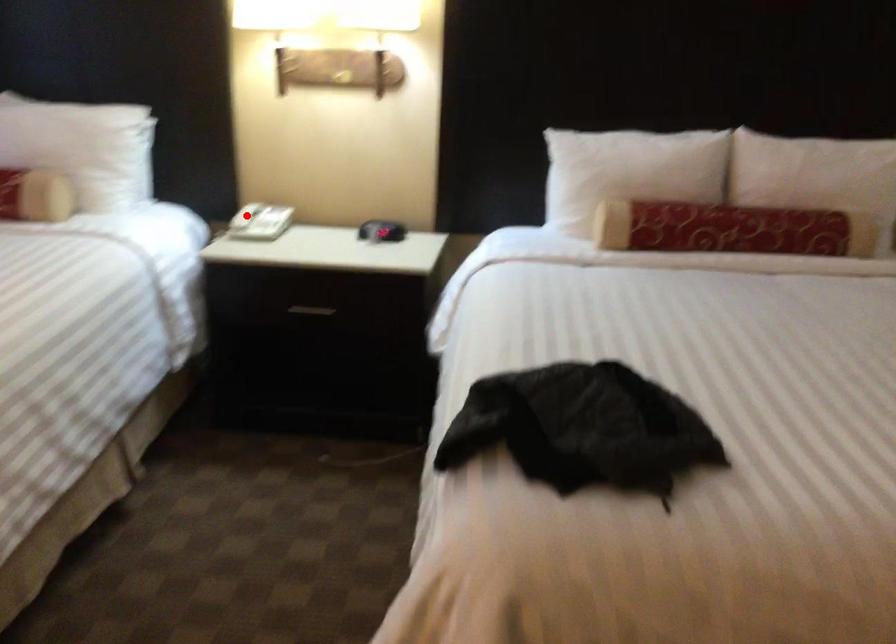
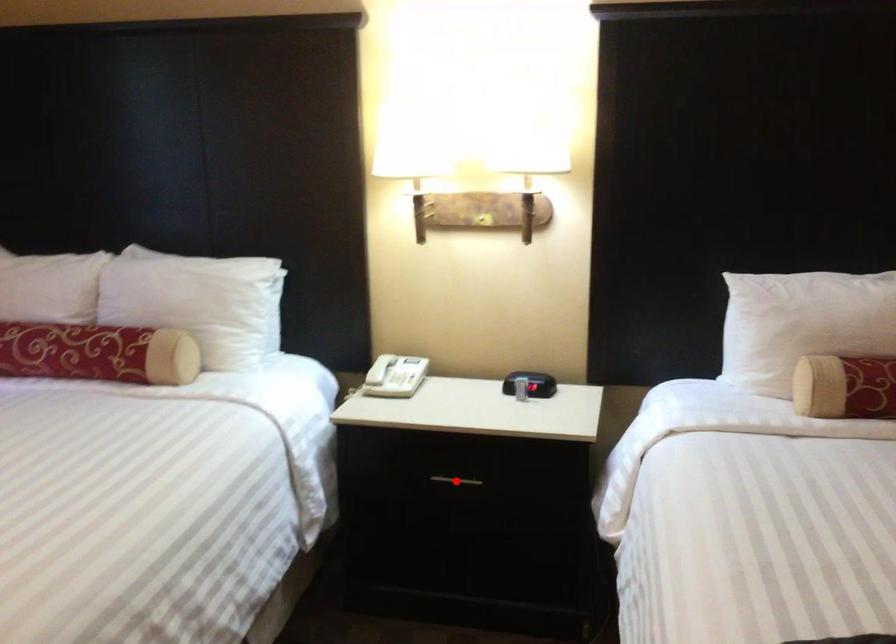
I am providing you with two images of the same scene from different viewpoints. A red point is marked on the first image and another point is marked on the second image. Does the point marked in image1 correspond to the same location as the one in image2?

No